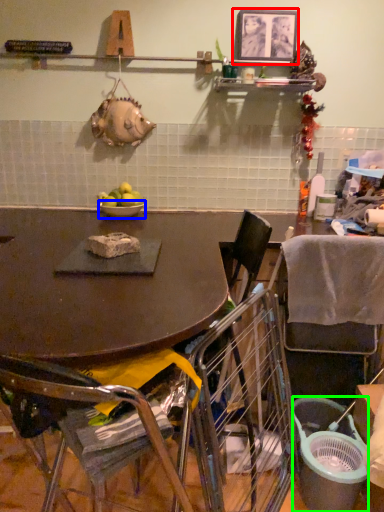
Question: Which object is positioned closest to picture frame (highlighted by a red box)? Select from bowl (highlighted by a blue box) and trash bin/can (highlighted by a green box).

Choices:
 (A) bowl
 (B) trash bin/can

Answer: (A)